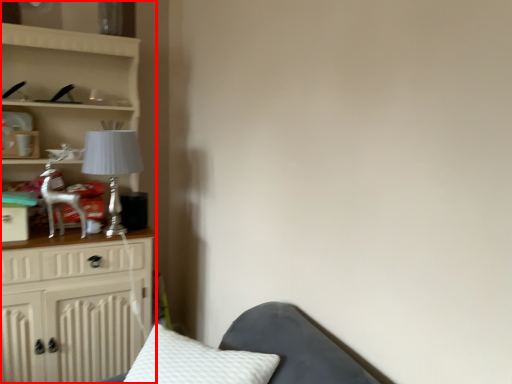
Question: From the image's perspective, considering the relative positions of furniture (annotated by the red box) and table lamp in the image provided, where is furniture (annotated by the red box) located with respect to the staircase?

Choices:
 (A) below
 (B) above

Answer: (A)